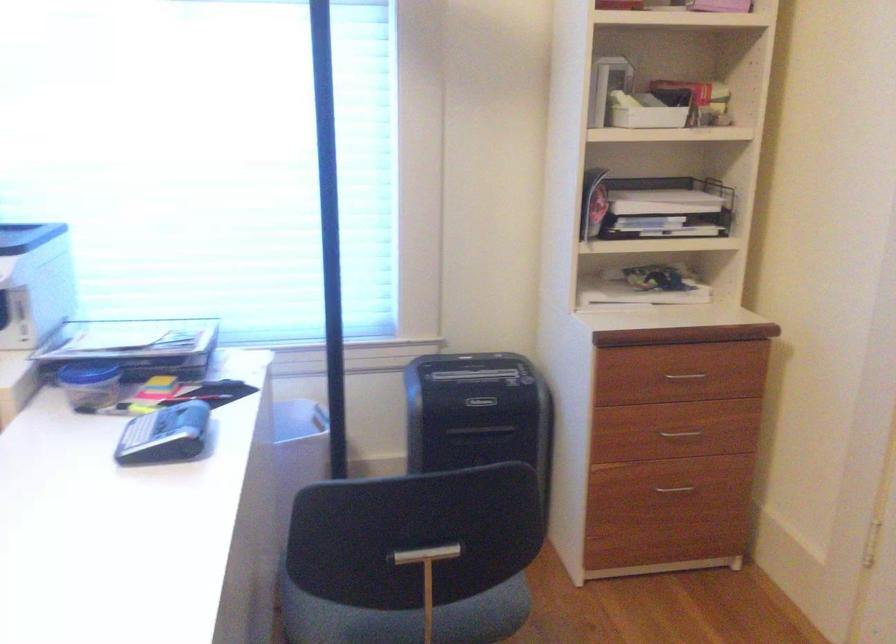
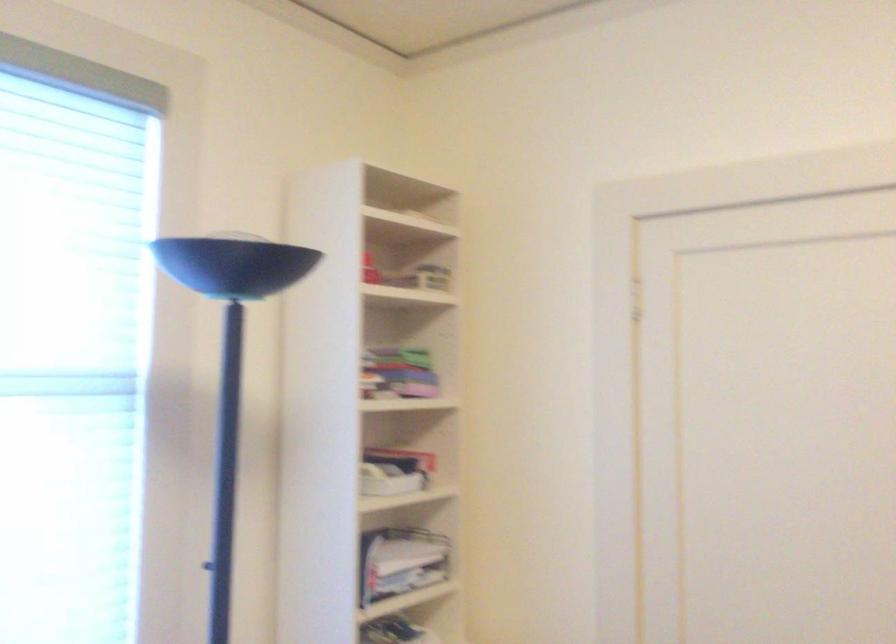
The first image is from the beginning of the video and the second image is from the end. How did the camera likely rotate when shooting the video?

The camera's rotation is toward right-up.